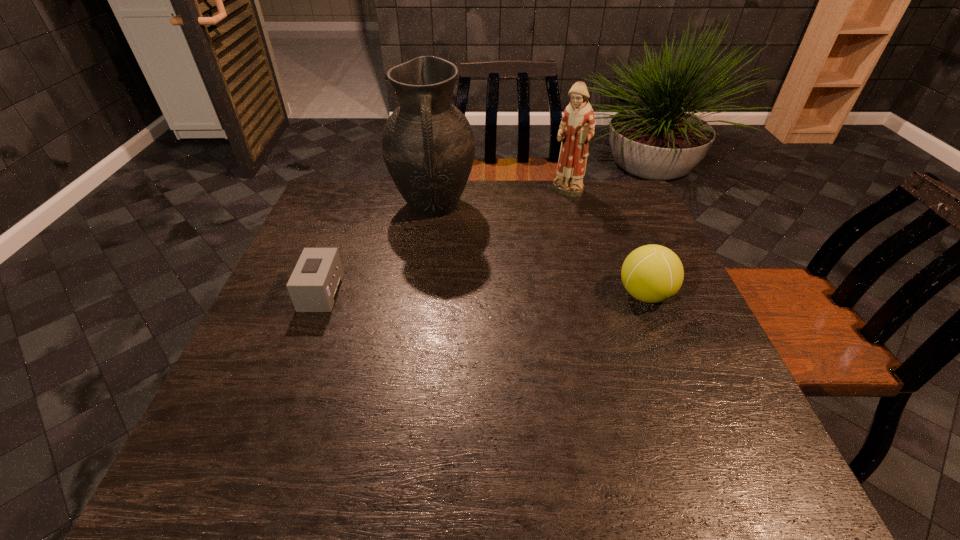
Find the location of a particular element. This screenshot has height=540, width=960. free space on the desktop that is between the leftmost object and the tennis ball and is positioned on the front-facing side of the second tallest object is located at coordinates (519, 294).

Identify the location of free space on the desktop that is between the alarm clock and the tennis ball and is positioned on the side of the pitcher with the handle. (439, 293).